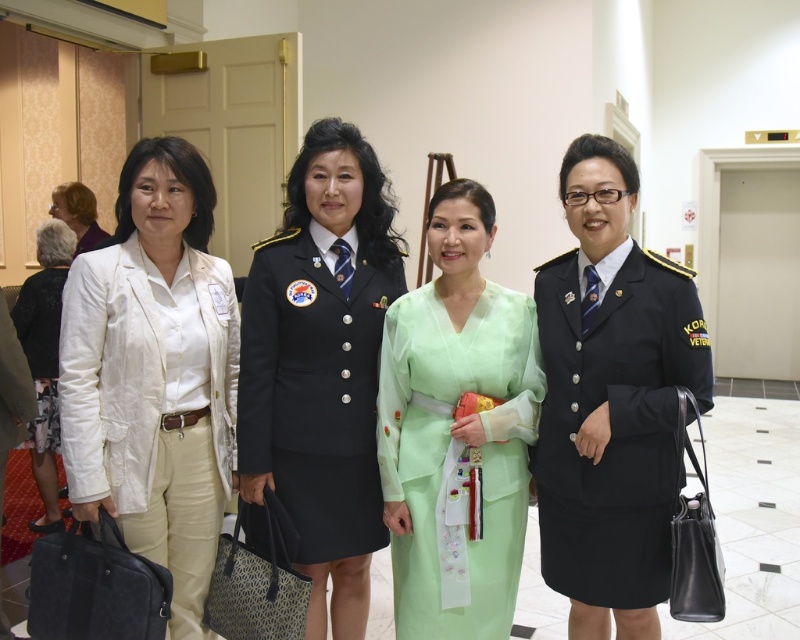
You are a photographer positioned in the hallway and want to take a photo that includes both the white linen blazer at left and the navy blue uniform at center. Which direction should you move to ensure both are in frame?

Since the white linen blazer at left is to the left of the navy blue uniform at center, you should move to the left to include both in your frame.

You are a photographer trying to capture a clear shot of the white linen blazer at left and the light brown hair at upper left. Which object is positioned closer to the camera?

The white linen blazer at left is closer to the viewer than the light brown hair at upper left, so it is positioned closer to the camera.

Based on the scene description, which object is taller between the white linen blazer at left and the light brown hair at upper left?

The white linen blazer at left is taller than the light brown hair at upper left according to the description.